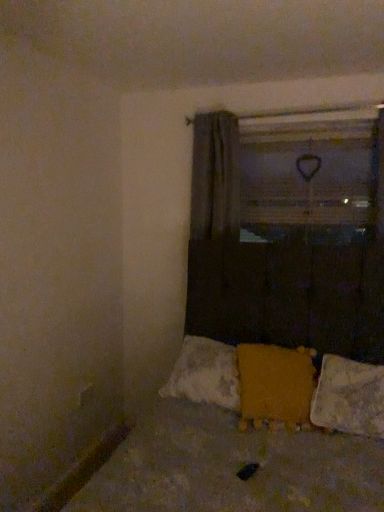
Question: From the image's perspective, relative to textured yellow fabric at lower center, is yellow fabric at center above or below?

Choices:
 (A) above
 (B) below

Answer: (A)

Question: From their relative heights in the image, would you say yellow fabric at center is taller or shorter than textured yellow fabric at lower center?

Choices:
 (A) tall
 (B) short

Answer: (B)

Question: Estimate the real-world distances between objects in this image. Which object is farther from the yellow fuzzy pillow at lower center, the 2th pillow from the right?

Choices:
 (A) white textured pillow at lower right, the first pillow from the right
 (B) yellow fabric at center
 (C) textured yellow fabric at lower center
 (D) transparent plastic window screen at upper center

Answer: (D)

Question: Considering the real-world distances, which object is farthest from the yellow fuzzy pillow at lower center, the 2th pillow from the right?

Choices:
 (A) textured yellow fabric at lower center
 (B) white textured pillow at lower right, the second pillow positioned from the left
 (C) transparent plastic window screen at upper center
 (D) yellow fabric at center

Answer: (C)